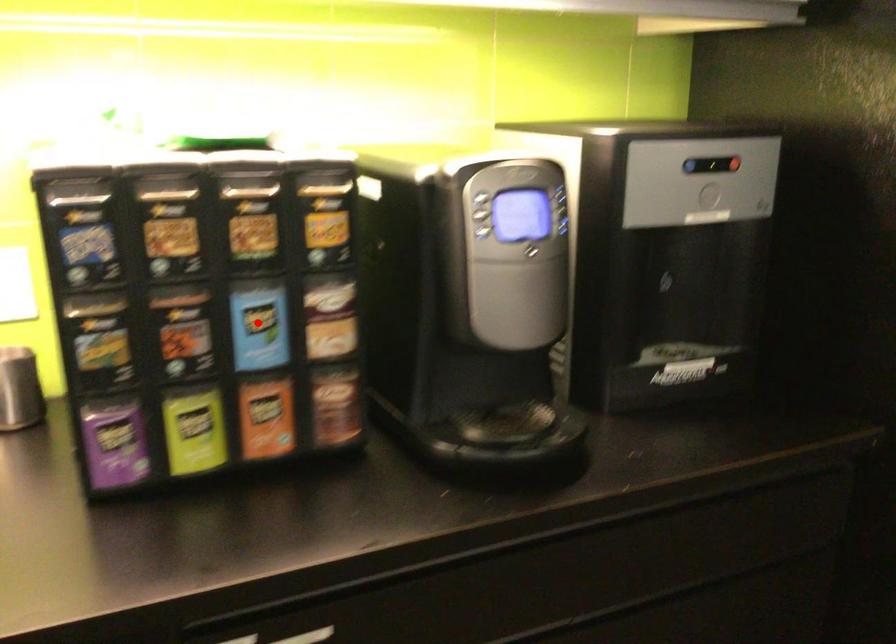
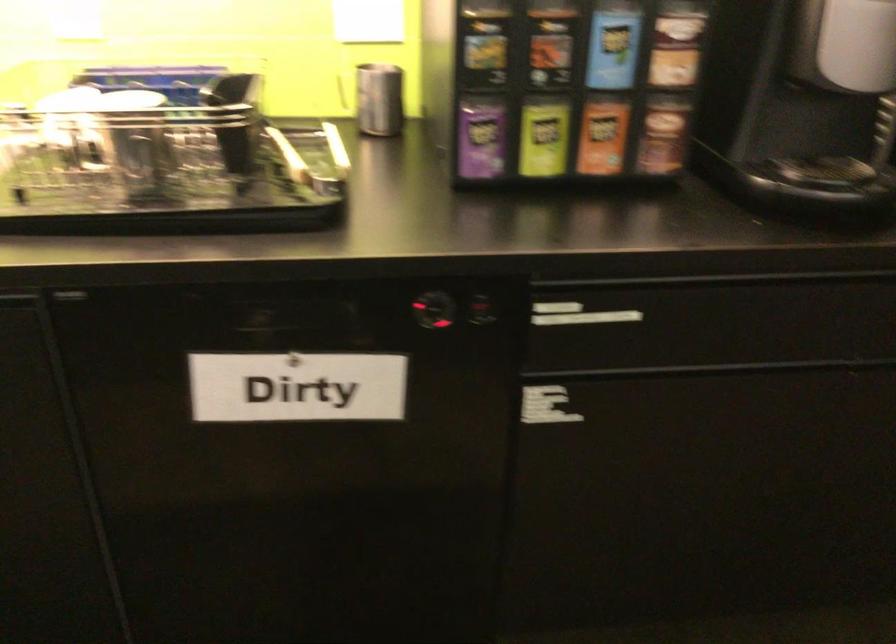
Question: I am providing you with two images of the same scene from different viewpoints. Image1 has a red point marked. In image2, the corresponding 3D location appears at what relative position? Reply with the corresponding letter.

Choices:
 (A) Closer
 (B) Farther

Answer: (B)